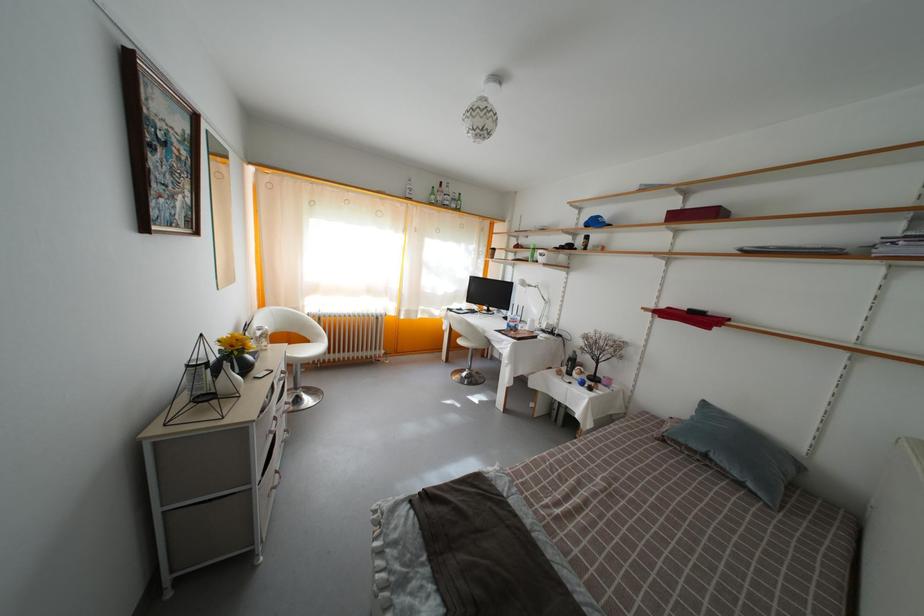
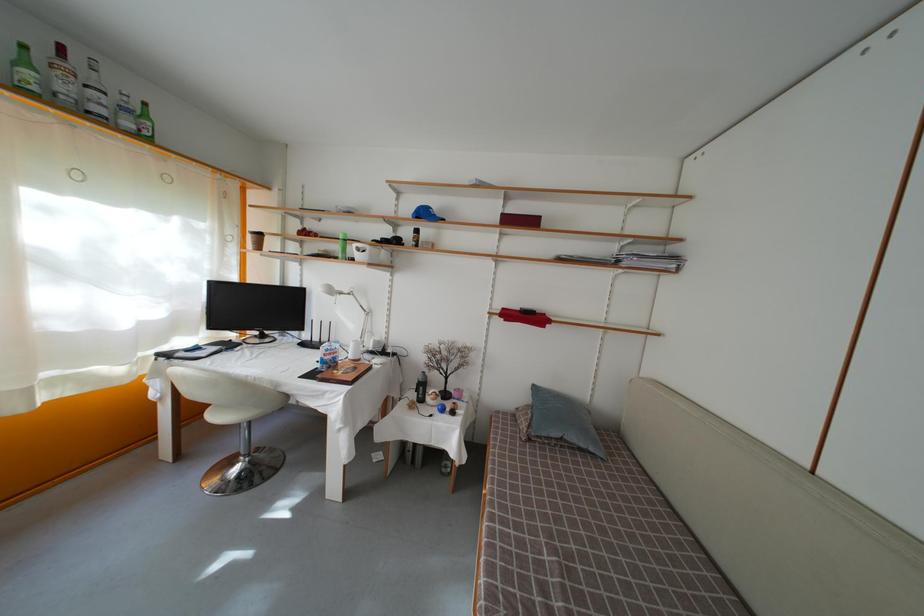
Question: The images are taken continuously from a first-person perspective. In which direction is your viewpoint rotating?

Choices:
 (A) Left
 (B) Right
 (C) Up
 (D) Down

Answer: (B)